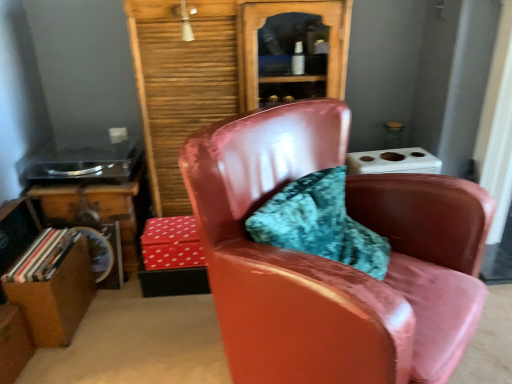
Question: Based on their positions, is wooden table at lower left located to the left or right of red dotted fabric box at center?

Choices:
 (A) left
 (B) right

Answer: (A)

Question: From the image's perspective, is wooden table at lower left above or below red dotted fabric box at center?

Choices:
 (A) below
 (B) above

Answer: (B)

Question: Which is farther from the red dotted fabric box at center?

Choices:
 (A) wooden bookcase at center
 (B) matte gray power outlet at upper left
 (C) glossy leather chair at center
 (D) wooden table at lower left

Answer: (B)

Question: Estimate the real-world distances between objects in this image. Which object is farther from the glossy leather chair at center?

Choices:
 (A) wooden table at lower left
 (B) matte gray power outlet at upper left
 (C) red dotted fabric box at center
 (D) wooden bookcase at center

Answer: (B)